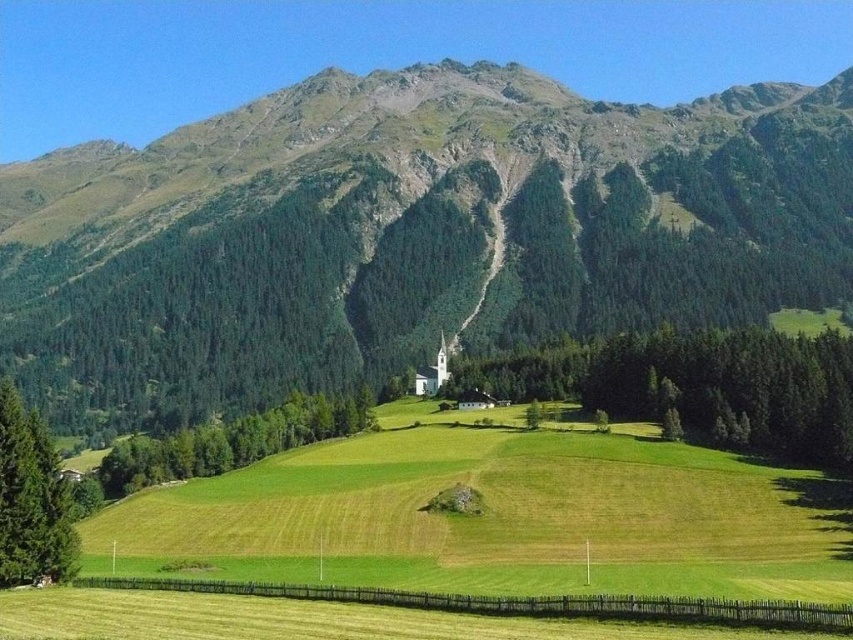
Who is lower down, green grassy mountain at center or green grassy field at center?

green grassy field at center is below.

Does point (253, 196) come closer to viewer compared to point (207, 525)?

No, (253, 196) is further to viewer.

Where is `green grassy mountain at center`? The height and width of the screenshot is (640, 853). green grassy mountain at center is located at coordinates (408, 234).